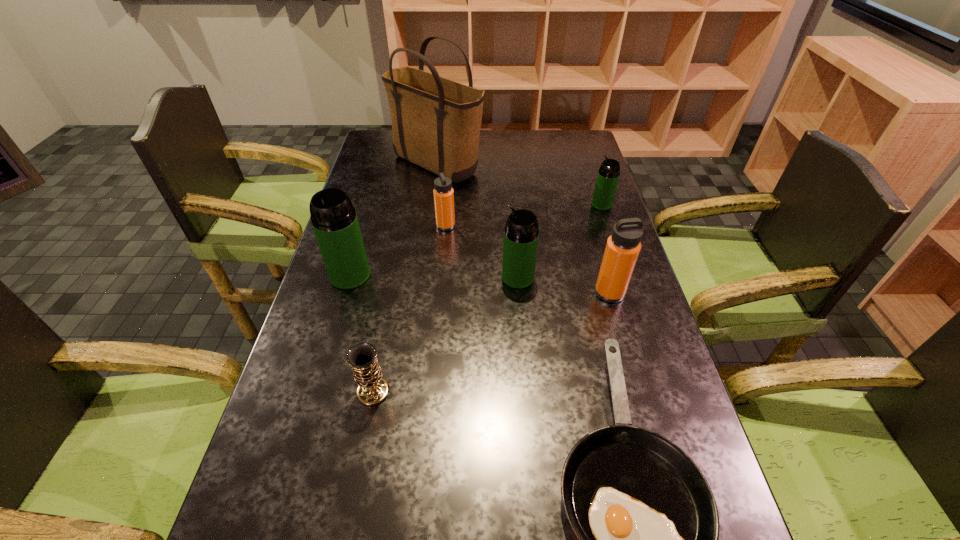
Locate which object is the seventh closest to the seventh tallest object. Please provide its 2D coordinates. Your answer should be formatted as a tuple, i.e. [(x, y)], where the tuple contains the x and y coordinates of a point satisfying the conditions above.

[(608, 175)]

Where is `thermos bottle that is the second nearest to the leftmost thermos bottle`? The height and width of the screenshot is (540, 960). thermos bottle that is the second nearest to the leftmost thermos bottle is located at coordinates (521, 233).

Locate an element on the screen. thermos bottle that is the closest to the chalice is located at coordinates (334, 220).

Identify which green thermos bottle is the closest to the farthest thermos bottle. Please provide its 2D coordinates. Your answer should be formatted as a tuple, i.e. [(x, y)], where the tuple contains the x and y coordinates of a point satisfying the conditions above.

[(521, 233)]

Locate an element on the screen. This screenshot has width=960, height=540. green thermos bottle identified as the second closest to the farthest object is located at coordinates (334, 220).

Where is `vacant point that satisfies the following two spatial constraints: 1. from the spout of the nearer orange thermos bottle; 2. on the left side of the tallest thermos bottle`? This screenshot has width=960, height=540. vacant point that satisfies the following two spatial constraints: 1. from the spout of the nearer orange thermos bottle; 2. on the left side of the tallest thermos bottle is located at coordinates (345, 293).

Image resolution: width=960 pixels, height=540 pixels. Identify the location of vacant space that satisfies the following two spatial constraints: 1. from the spout of the smallest green thermos bottle; 2. on the front side of the right orange thermos bottle. click(631, 293).

This screenshot has width=960, height=540. I want to click on free point that satisfies the following two spatial constraints: 1. from the spout of the bigger orange thermos bottle; 2. on the left side of the leftmost green thermos bottle, so point(345,293).

Locate an element on the screen. Image resolution: width=960 pixels, height=540 pixels. vacant area in the image that satisfies the following two spatial constraints: 1. on the front side of the bigger orange thermos bottle; 2. on the left side of the smaller orange thermos bottle is located at coordinates (440, 293).